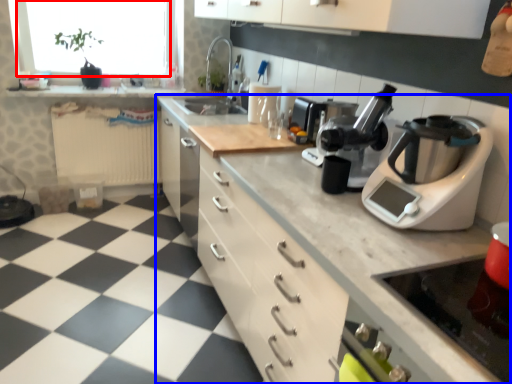
Question: Which point is further to the camera, window screen (highlighted by a red box) or countertop (highlighted by a blue box)?

Choices:
 (A) window screen
 (B) countertop

Answer: (A)